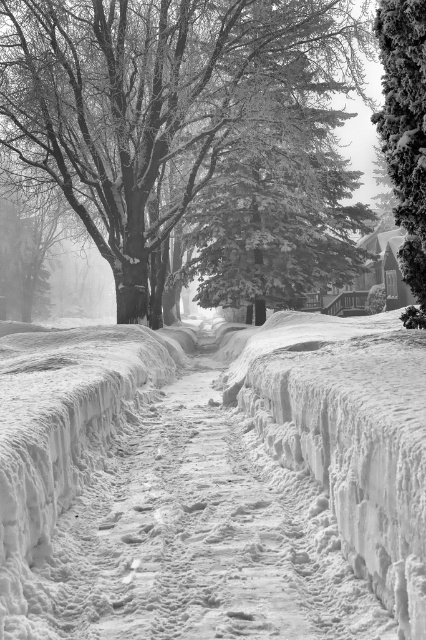
Question: Can you confirm if snow-covered tree at upper left is thinner than snow-covered evergreen tree at right?

Choices:
 (A) no
 (B) yes

Answer: (A)

Question: Which is farther from the snow-covered tree at upper left?

Choices:
 (A) snow-covered evergreen tree at right
 (B) white snow pavement at center

Answer: (B)

Question: Estimate the real-world distances between objects in this image. Which object is closer to the white snow pavement at center?

Choices:
 (A) snow-covered evergreen tree at right
 (B) snow-covered tree at upper left

Answer: (A)

Question: Which point is farther to the camera?

Choices:
 (A) snow-covered tree at upper left
 (B) snow-covered evergreen tree at right

Answer: (A)

Question: Can you confirm if snow-covered tree at upper left is wider than white snow pavement at center?

Choices:
 (A) no
 (B) yes

Answer: (B)

Question: Can you confirm if snow-covered tree at upper left is positioned above white snow pavement at center?

Choices:
 (A) no
 (B) yes

Answer: (B)